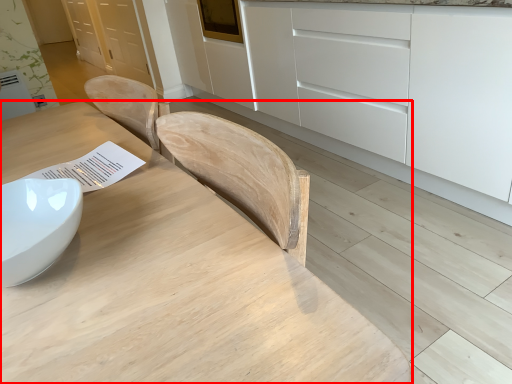
Question: From the image's perspective, what is the correct spatial relationship of table (annotated by the red box) in relation to cabinetry?

Choices:
 (A) above
 (B) below

Answer: (B)